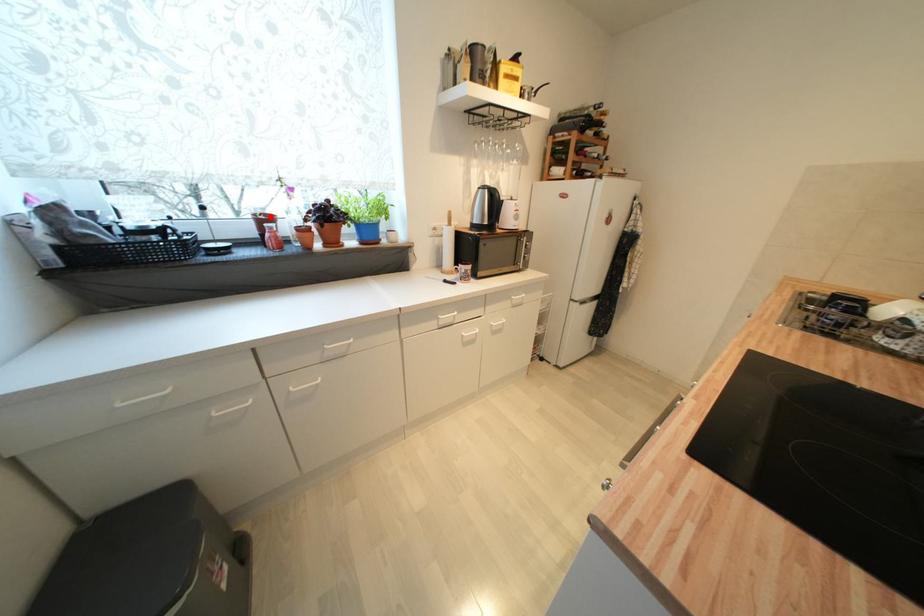
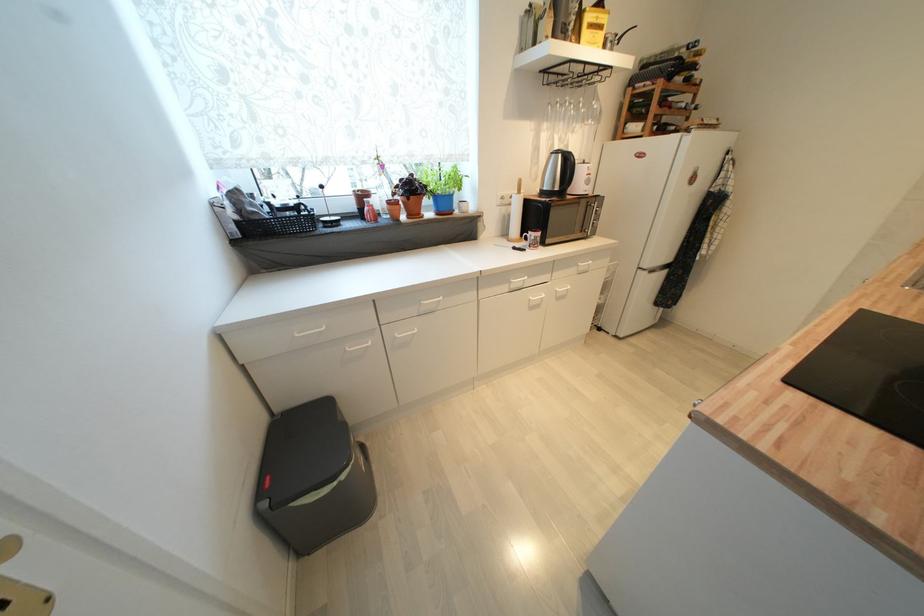
In the second image, find the point that corresponds to the highlighted location in the first image.

(368, 193)